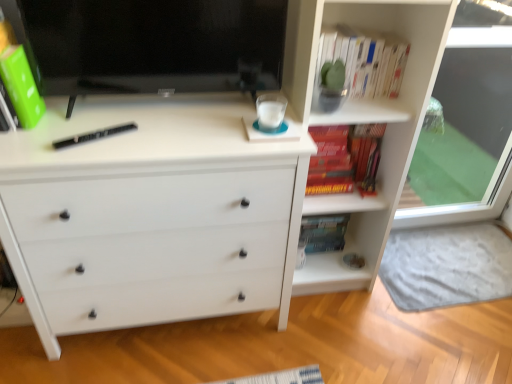
This screenshot has height=384, width=512. In order to click on free space to the right of black hardback book at center in this screenshot , I will do `click(152, 140)`.